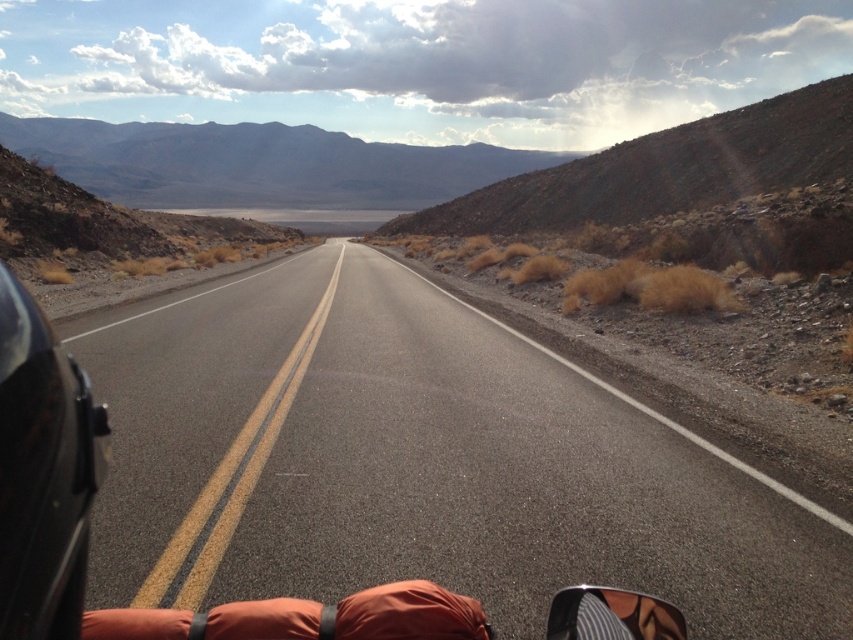
You are riding a motorcycle and need to secure your orange fabric sleeping bag at lower center. Given the size of your black glossy motorcycle at left, can you safely place the sleeping bag on the motorcycle without it affecting your balance?

The black glossy motorcycle at left has a larger size compared to the orange fabric sleeping bag at lower center. Since the motorcycle is larger, it should provide sufficient space to securely place the sleeping bag without compromising balance, provided it is properly secured.

Based on the photo, you are a motorcyclist riding the black glossy motorcycle at left and you see the orange fabric sleeping bag at lower center. Can you safely lift the sleeping bag onto the motorcycle without bending over too much?

The black glossy motorcycle at left is taller than the orange fabric sleeping bag at lower center, so you can safely lift the sleeping bag onto the motorcycle without bending over too much.